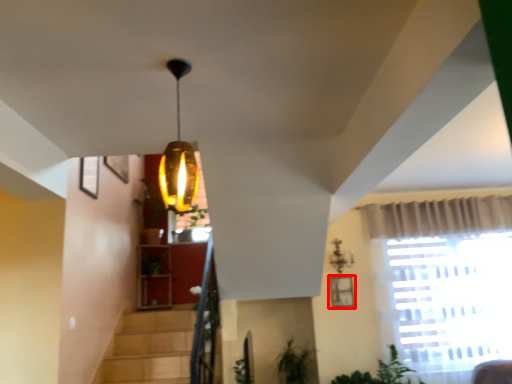
Question: Where is picture frame (annotated by the red box) located in relation to lamp in the image?

Choices:
 (A) left
 (B) right

Answer: (B)